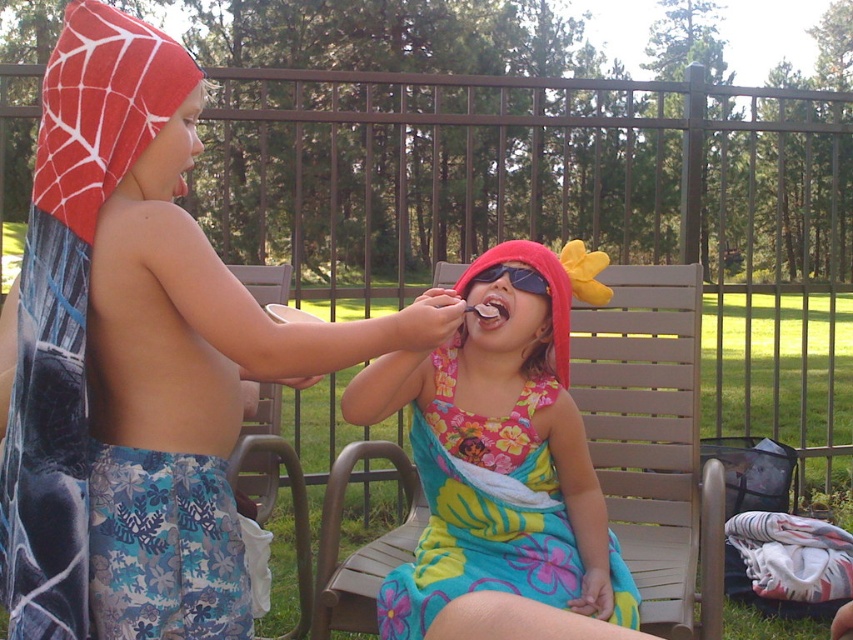
Does floral fabric dress at center appear on the right side of black plastic goggles at upper center?

No, floral fabric dress at center is not to the right of black plastic goggles at upper center.

You are a GUI agent. You are given a task and a screenshot of the screen. Output one action in this format:
    pyautogui.click(x=<x>, y=<y>)
    Task: Click on the floral fabric dress at center
    
    Given the screenshot: What is the action you would take?
    pyautogui.click(x=137, y=365)

Is spiderman towel at upper left below matte pink sunglasses at center?

Incorrect, spiderman towel at upper left is not positioned below matte pink sunglasses at center.

What do you see at coordinates (169, 154) in the screenshot? This screenshot has height=640, width=853. I see `spiderman towel at upper left` at bounding box center [169, 154].

Where is `spiderman towel at upper left`? spiderman towel at upper left is located at coordinates (169, 154).

Measure the distance from floral print fabric dress at center to spiderman towel at upper left.

floral print fabric dress at center and spiderman towel at upper left are 32.21 inches apart.

Can you confirm if floral print fabric dress at center is thinner than spiderman towel at upper left?

In fact, floral print fabric dress at center might be wider than spiderman towel at upper left.

Where is `floral print fabric dress at center`? floral print fabric dress at center is located at coordinates (483, 508).

I want to click on floral print fabric dress at center, so click(x=483, y=508).